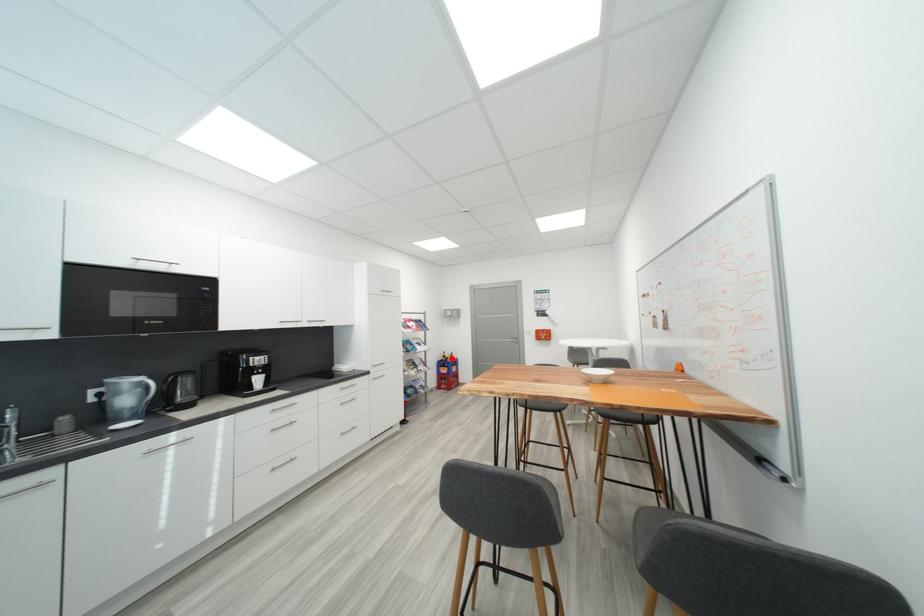
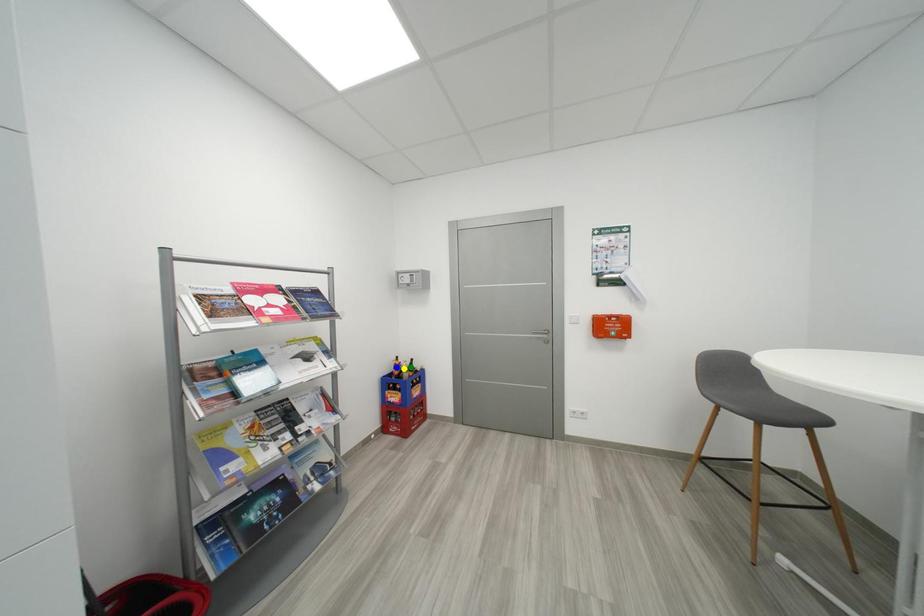
Question: I am providing you with two images of the same scene from different viewpoints. A red point is marked on the first image. You are given multiple points on the second image. Which spot in image 2 lines up with the point in image 1?

Choices:
 (A) yellow point
 (B) green point
 (C) blue point

Answer: (A)